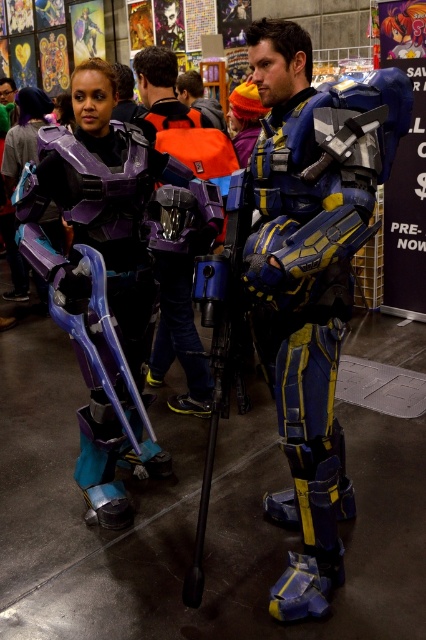
Is blue metallic armor at center further to camera compared to matte black armor at center?

No, it is not.

Which is above, blue metallic armor at center or matte black armor at center?

matte black armor at center is higher up.

Which is behind, point (324, 426) or point (46, 221)?

Point (46, 221)

Find the location of a particular element. Image resolution: width=426 pixels, height=640 pixels. blue metallic armor at center is located at coordinates (311, 276).

Is shiny blue armor at center below metallic blue armor at center?

Correct, shiny blue armor at center is located below metallic blue armor at center.

Between point (176, 342) and point (189, 97), which one is positioned behind?

The point (189, 97) is more distant.

Identify the location of shiny blue armor at center. (180, 120).

In the scene shown: Is matte purple armor at left above matte black armor at center?

Incorrect, matte purple armor at left is not positioned above matte black armor at center.

Is point (103, 246) positioned before point (11, 298)?

That is True.

Identify the location of matte purple armor at left. (100, 276).